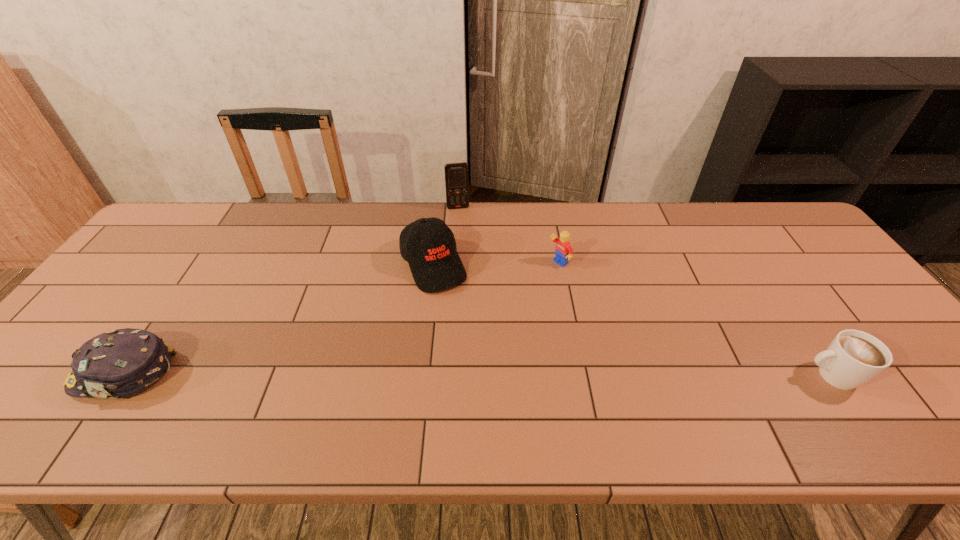
Find the location of a particular element. The image size is (960, 540). free space on the desktop that is between the leftmost object and the rightmost object and is positioned on the screen of the cellular telephone is located at coordinates (490, 375).

Where is `vacant space on the desktop that is between the leftmost object and the rightmost object and is positioned on the face of the fourth object from left to right`? vacant space on the desktop that is between the leftmost object and the rightmost object and is positioned on the face of the fourth object from left to right is located at coordinates (379, 374).

Where is `vacant space on the desktop that is between the leftmost object and the rightmost object and is positioned on the front-facing side of the baseball cap`? vacant space on the desktop that is between the leftmost object and the rightmost object and is positioned on the front-facing side of the baseball cap is located at coordinates point(499,375).